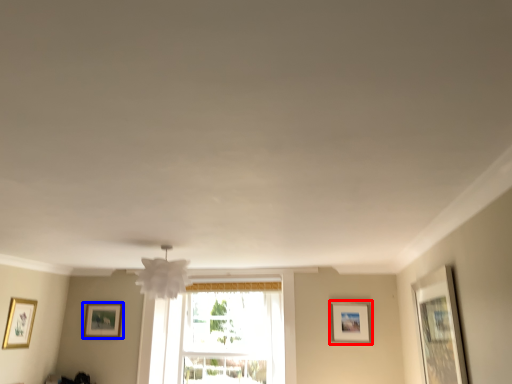
Question: Which of the following is the farthest to the observer, picture frame (highlighted by a red box) or picture frame (highlighted by a blue box)?

Choices:
 (A) picture frame
 (B) picture frame

Answer: (B)